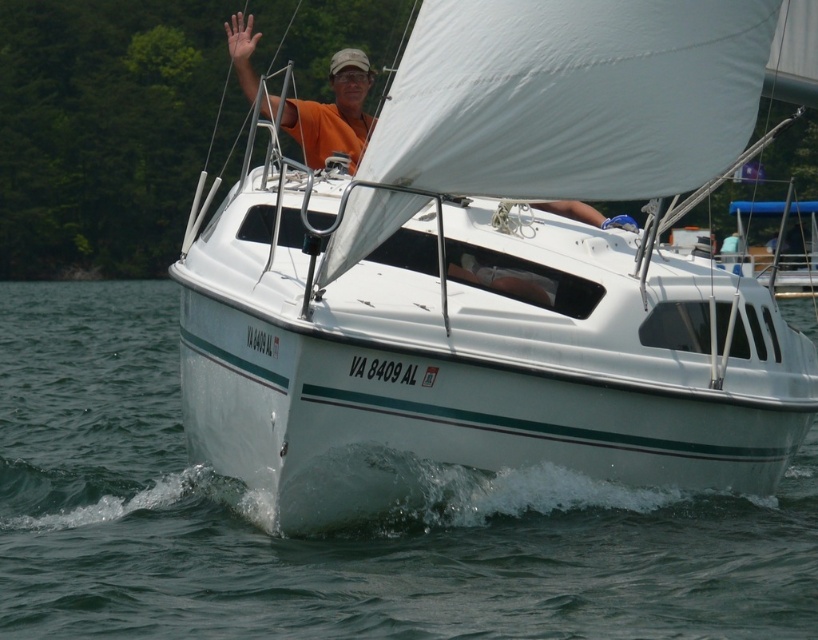
You are a photographer on a nearby dock and want to capture a photo of the orange fabric shirt at upper center and the white glossy sailboat at center. Based on their positions, which object should you focus on first to ensure both are in the frame?

The orange fabric shirt at upper center is located above the white glossy sailboat at center, so you should focus on the orange fabric shirt at upper center first to ensure both are in the frame.

You are a photographer trying to capture the white glossy sailboat at center and the clear water at lower center in a single shot. Based on their sizes, which object should appear smaller in the photo?

The white glossy sailboat at center is not as tall as the clear water at lower center, so it should appear smaller in the photo.